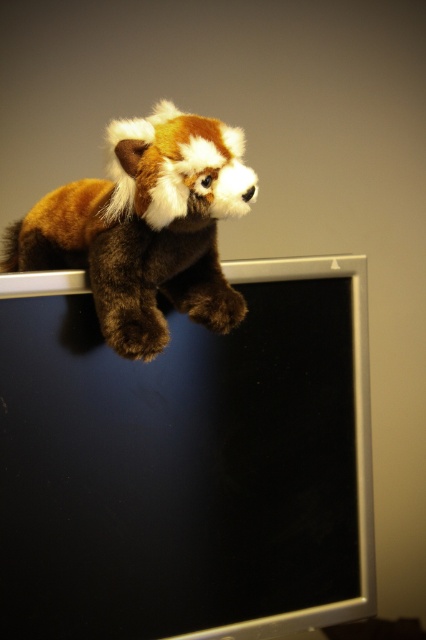
Does black matte computer monitor at upper left have a greater width compared to brown plush toy at upper left?

Correct, the width of black matte computer monitor at upper left exceeds that of brown plush toy at upper left.

Who is lower down, black matte computer monitor at upper left or brown plush toy at upper left?

black matte computer monitor at upper left is below.

Image resolution: width=426 pixels, height=640 pixels. Describe the element at coordinates (187, 461) in the screenshot. I see `black matte computer monitor at upper left` at that location.

Identify the location of black matte computer monitor at upper left. This screenshot has width=426, height=640. (187, 461).